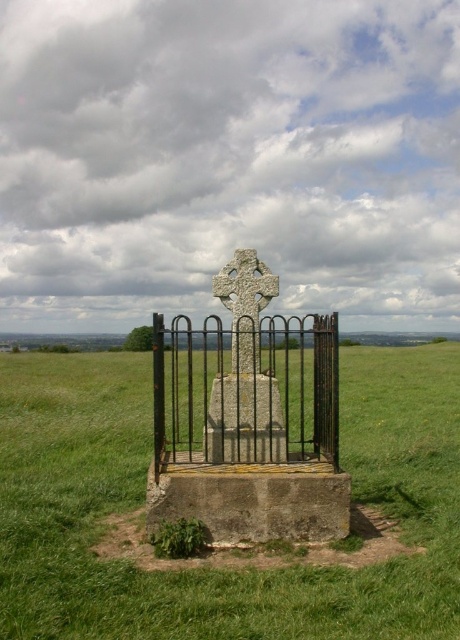
Who is positioned more to the left, black wrought iron fence at center or white stone cross at center?

black wrought iron fence at center

Is black wrought iron fence at center thinner than white stone cross at center?

Incorrect, black wrought iron fence at center's width is not less than white stone cross at center's.

Is point (263, 424) closer to viewer compared to point (241, 285)?

Yes, point (263, 424) is closer to viewer.

Identify the location of black wrought iron fence at center. This screenshot has width=460, height=640. (247, 392).

In the scene shown: Does green grassy at center lie in front of black wrought iron fence at center?

Yes, it is in front of black wrought iron fence at center.

This screenshot has height=640, width=460. Describe the element at coordinates (214, 572) in the screenshot. I see `green grassy at center` at that location.

Find the location of a particular element. green grassy at center is located at coordinates (214, 572).

Is smooth stone gravestone at center thinner than white stone cross at center?

No.

What do you see at coordinates (245, 420) in the screenshot? Image resolution: width=460 pixels, height=640 pixels. I see `smooth stone gravestone at center` at bounding box center [245, 420].

Find the location of `smooth stone gravestone at center`. smooth stone gravestone at center is located at coordinates click(245, 420).